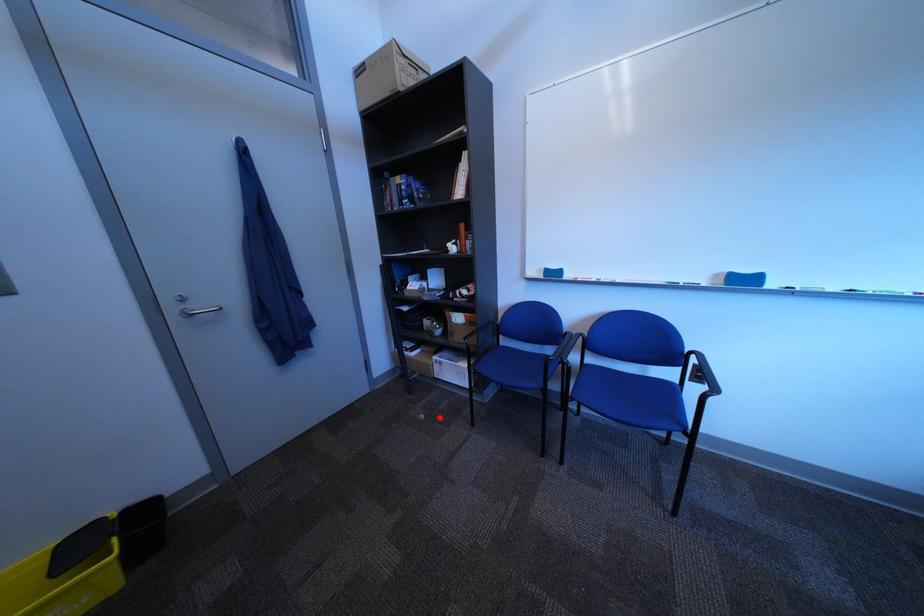
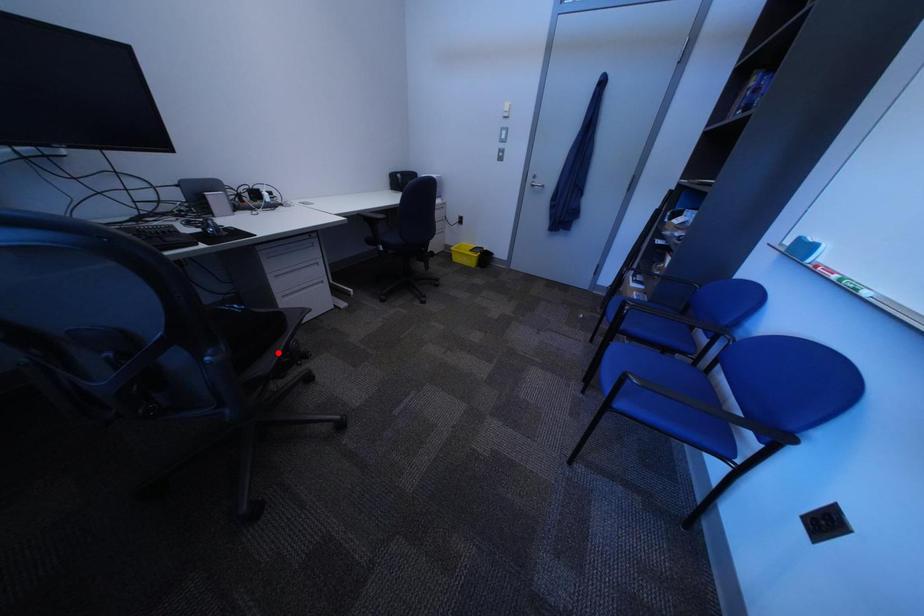
I am providing you with two images of the same scene from different viewpoints. A red point is marked on the first image and another point is marked on the second image. Are the points marked in image1 and image2 representing the same 3D position?

No